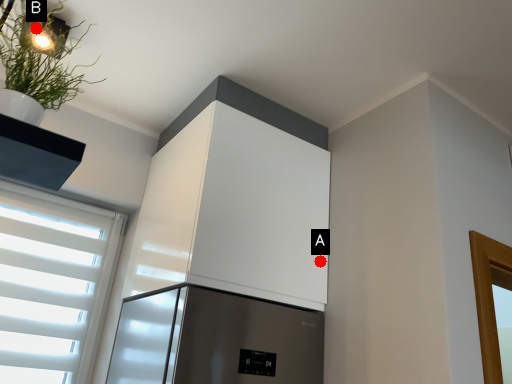
Question: Two points are circled on the image, labeled by A and B beside each circle. Which point appears closest to the camera in this image?

Choices:
 (A) A is closer
 (B) B is closer

Answer: (B)